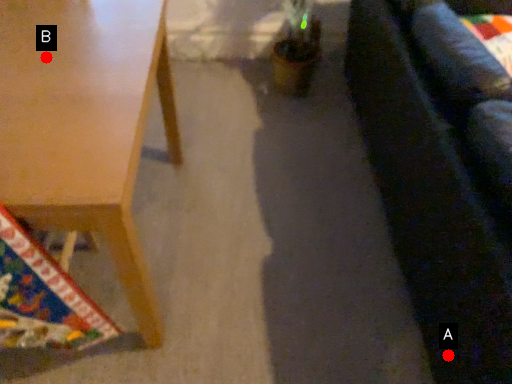
Question: Two points are circled on the image, labeled by A and B beside each circle. Which point is closer to the camera taking this photo?

Choices:
 (A) A is closer
 (B) B is closer

Answer: (A)